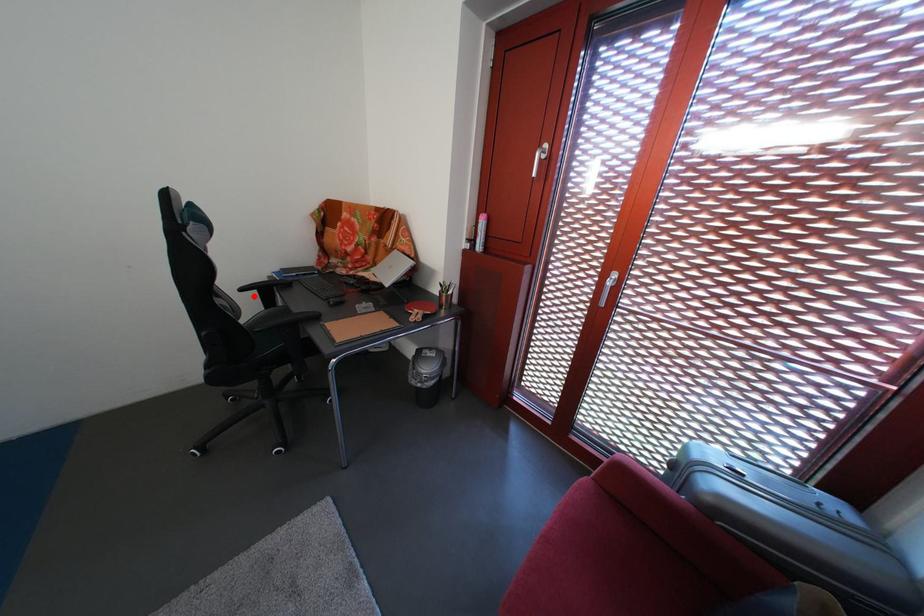
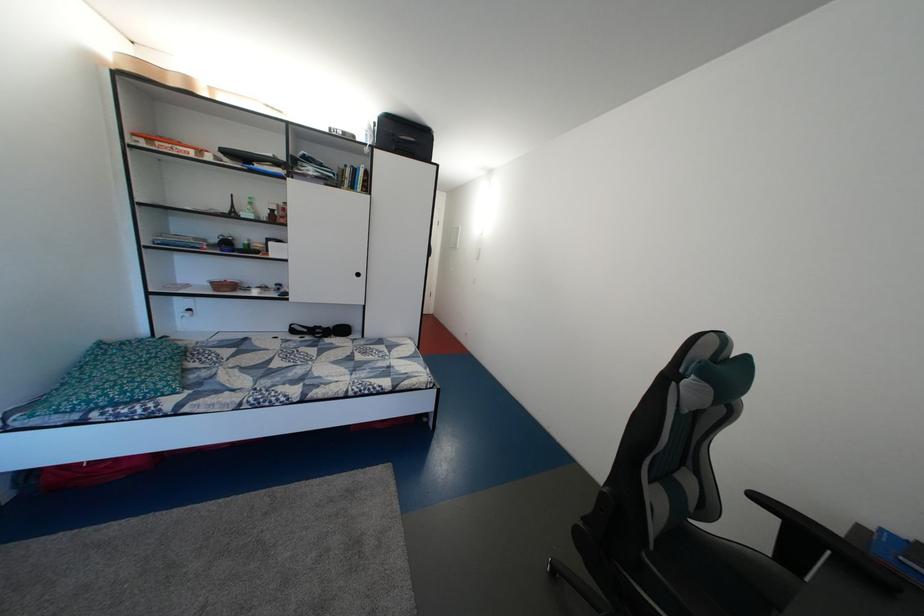
The point at the highlighted location is marked in the first image. Where is the corresponding point in the second image?

(768, 504)